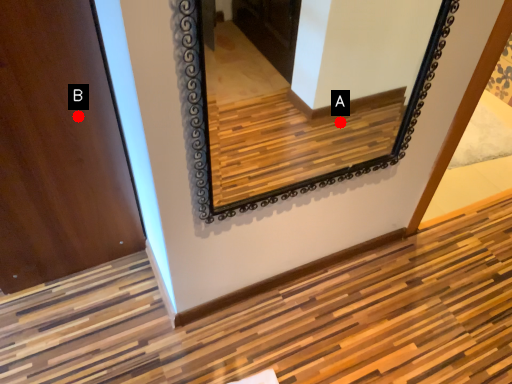
Question: Two points are circled on the image, labeled by A and B beside each circle. Which of the following is the closest to the observer?

Choices:
 (A) A is closer
 (B) B is closer

Answer: (B)